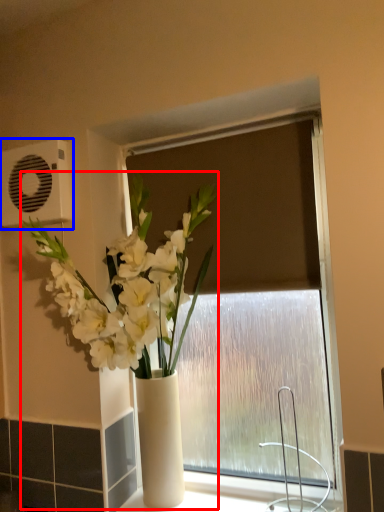
Question: Which of the following is the farthest to the observer, houseplant (highlighted by a red box) or air conditioning (highlighted by a blue box)?

Choices:
 (A) houseplant
 (B) air conditioning

Answer: (B)